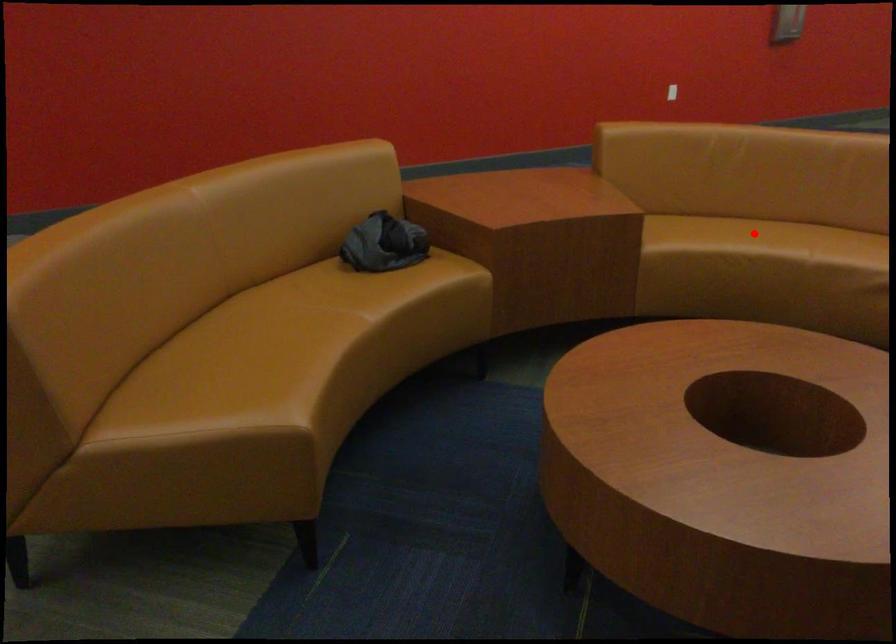
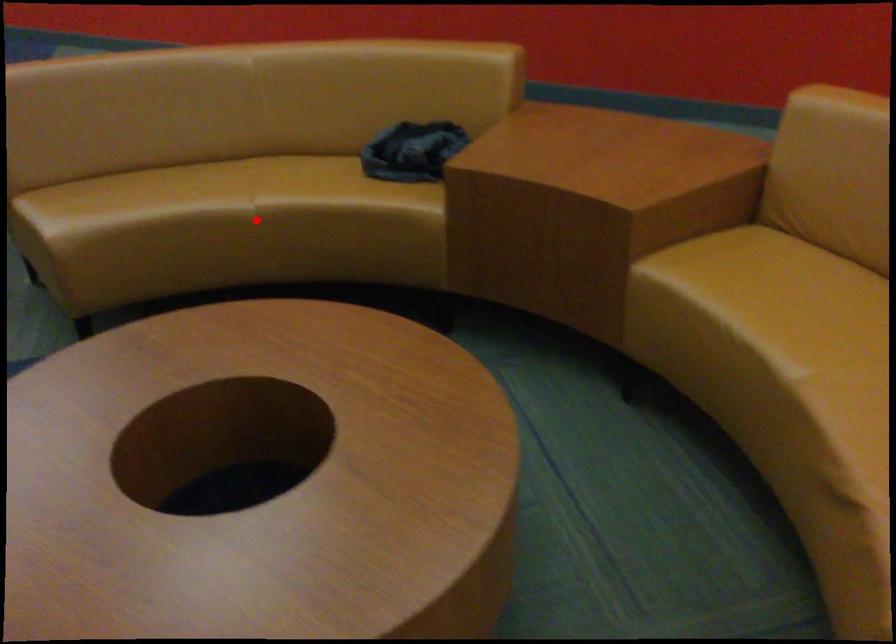
I am providing you with two images of the same scene from different viewpoints. A red point is marked on the first image and another point is marked on the second image. Is the marked point in image1 the same physical position as the marked point in image2?

No